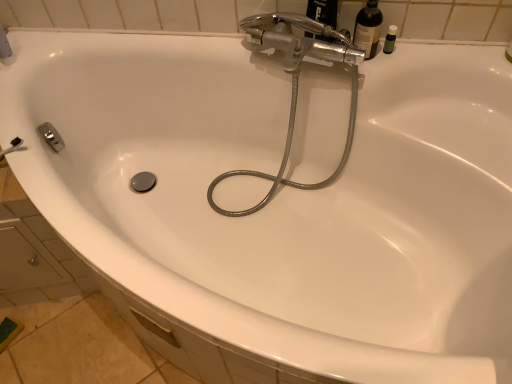
Question: From the image's perspective, relative to translucent glass bottle at upper right, is metallic hose at center above or below?

Choices:
 (A) above
 (B) below

Answer: (B)

Question: Is metallic hose at center spatially inside translucent glass bottle at upper right, or outside of it?

Choices:
 (A) outside
 (B) inside

Answer: (A)

Question: Which object is the closest to the metallic hose at center?

Choices:
 (A) green plastic bottle at upper right
 (B) translucent glass bottle at upper right

Answer: (B)

Question: Which object is the farthest from the metallic hose at center?

Choices:
 (A) translucent glass bottle at upper right
 (B) green plastic bottle at upper right

Answer: (B)